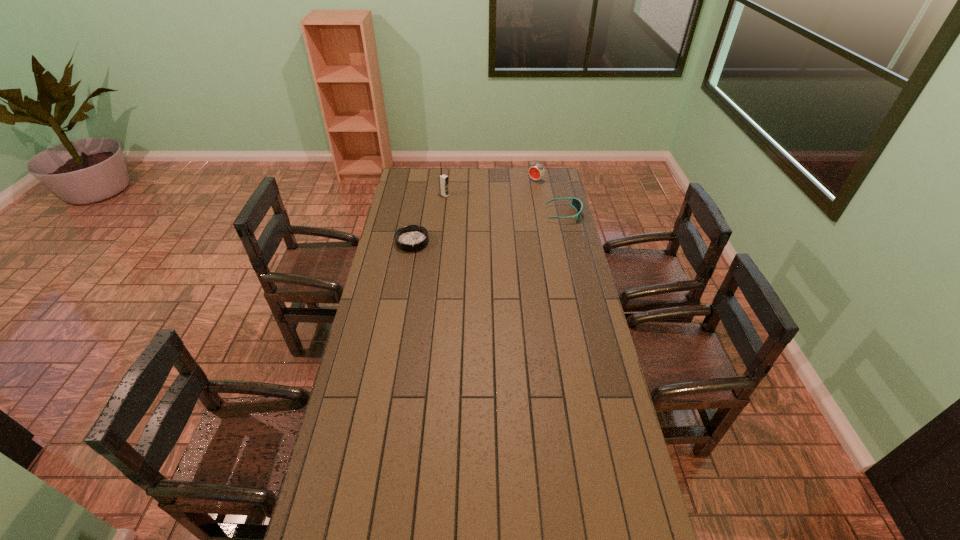
Where is `free space on the desktop that is between the nearest object and the second shortest object and is positioned on the face of the farthest object`? free space on the desktop that is between the nearest object and the second shortest object and is positioned on the face of the farthest object is located at coordinates (x=472, y=231).

Locate an element on the screen. The height and width of the screenshot is (540, 960). vacant spot on the desktop that is between the leftmost object and the sunglasses and is positioned on the front-facing side of the cellular telephone is located at coordinates (511, 224).